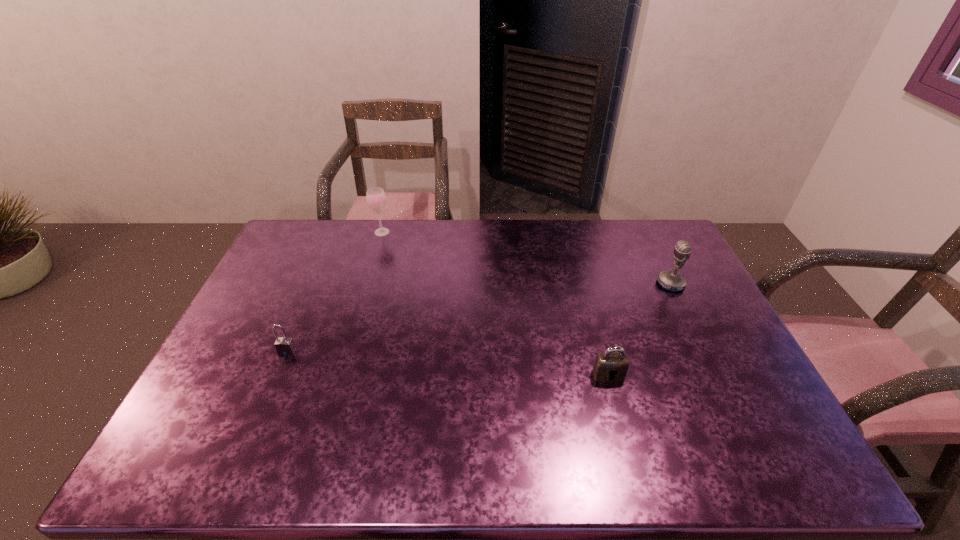
I want to click on empty location between the second object from left to right and the right padlock, so click(x=495, y=303).

This screenshot has width=960, height=540. Identify the location of vacant space in between the second nearest object and the right padlock. (447, 363).

Identify which object is the nearest to the farther padlock. Please provide its 2D coordinates. Your answer should be formatted as a tuple, i.e. [(x, y)], where the tuple contains the x and y coordinates of a point satisfying the conditions above.

[(376, 198)]

Locate an element on the screen. This screenshot has height=540, width=960. object that stands as the second closest to the rightmost object is located at coordinates (376, 198).

Where is `blank area in the image that satisfies the following two spatial constraints: 1. on the front-facing side of the rightmost object; 2. at the front of the second object from right to left near the keyhole`? This screenshot has height=540, width=960. blank area in the image that satisfies the following two spatial constraints: 1. on the front-facing side of the rightmost object; 2. at the front of the second object from right to left near the keyhole is located at coordinates (715, 375).

This screenshot has height=540, width=960. What are the coordinates of `vacant space that satisfies the following two spatial constraints: 1. on the front-facing side of the rightmost object; 2. on the shackle of the farther padlock` in the screenshot? It's located at (704, 352).